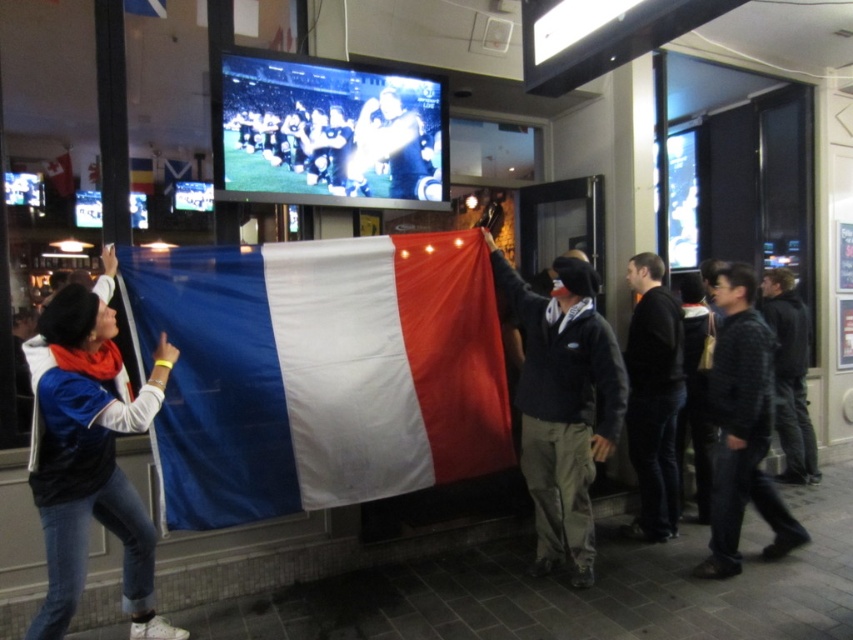
You are a customer at the sports bar and want to take a photo of the blue fabric flag at left and the black smooth jacket at right. Which object should you frame first in your camera to ensure both are in the shot?

The blue fabric flag at left should be framed first since it is positioned to the left of the black smooth jacket at right, so starting with the leftmost object ensures both are included in the frame.

You are standing in the sports bar and want to place a small table between the two points labeled point (614,358) and point (767,442). Which point is closer to you where you should start placing the table?

Point (614,358) is closer to the viewer than point (767,442), so you should start placing the table near point (614,358).

Based on the photo, you are standing in the sports bar and see the point at coordinates (x=741, y=428). What object is this point located on?

The point at coordinates (x=741, y=428) is located on the dark gray textured sweater at right.